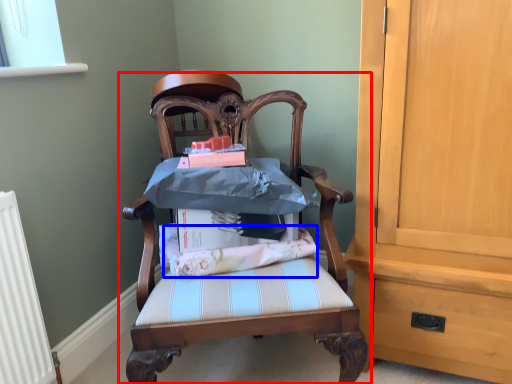
Question: Among these objects, which one is farthest to the camera, chair (highlighted by a red box) or fabric (highlighted by a blue box)?

Choices:
 (A) chair
 (B) fabric

Answer: (B)